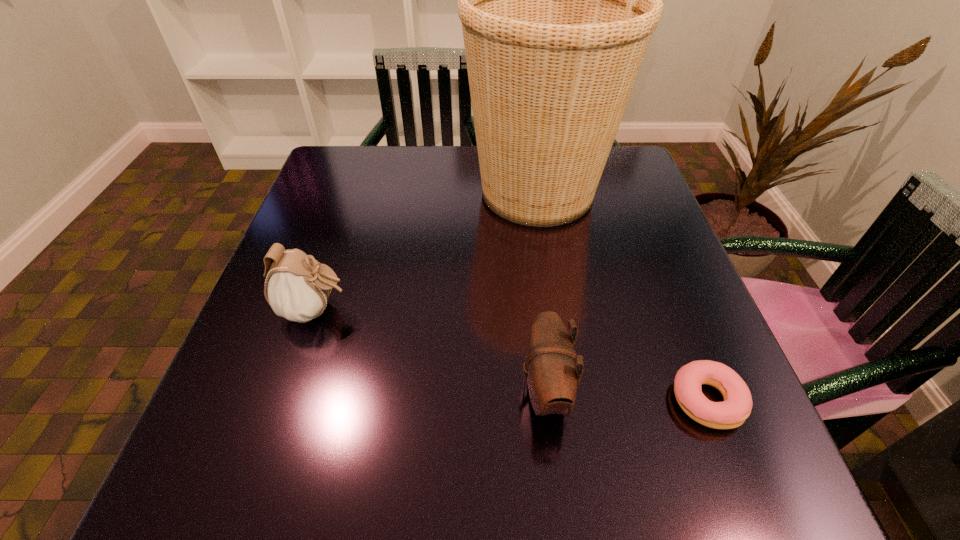
Identify the location of vacant region that satisfies the following two spatial constraints: 1. on the back side of the shortest object; 2. on the front-facing side of the farther pouch. The height and width of the screenshot is (540, 960). (672, 310).

At what (x,y) coordinates should I click in order to perform the action: click on vacant space that satisfies the following two spatial constraints: 1. with the flap open on the right pouch; 2. on the left side of the shortest object. Please return your answer as a coordinate pair (x, y). The width and height of the screenshot is (960, 540). Looking at the image, I should click on (546, 400).